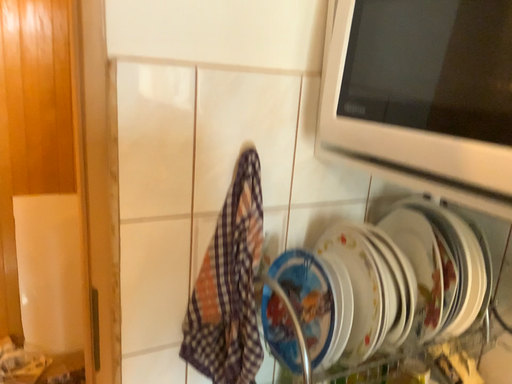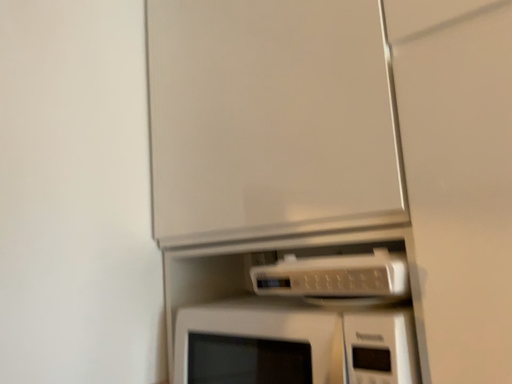
Question: Which way did the camera rotate in the video?

Choices:
 (A) rotated right
 (B) rotated left

Answer: (A)